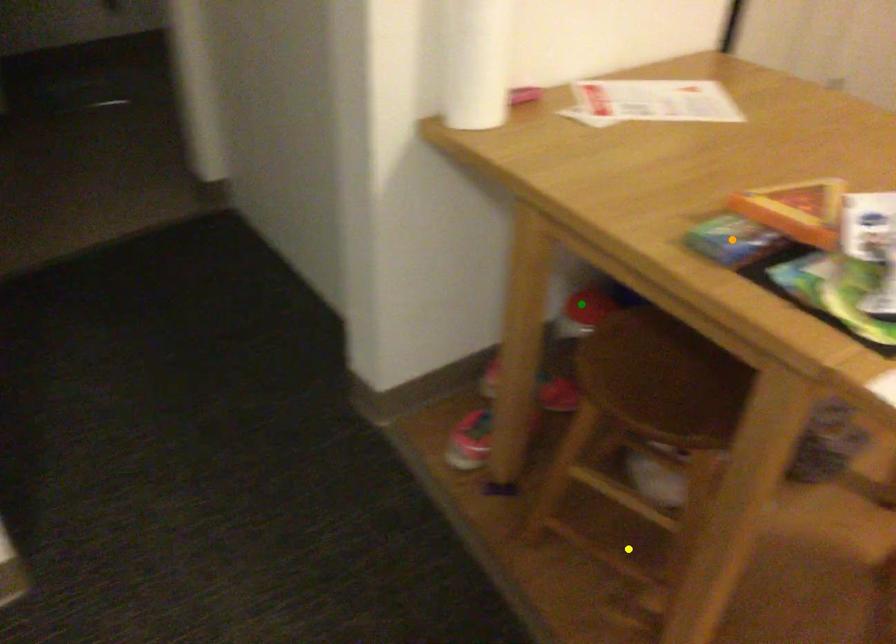
Order these from nearest to farthest:
- green point
- yellow point
- orange point

orange point → yellow point → green point